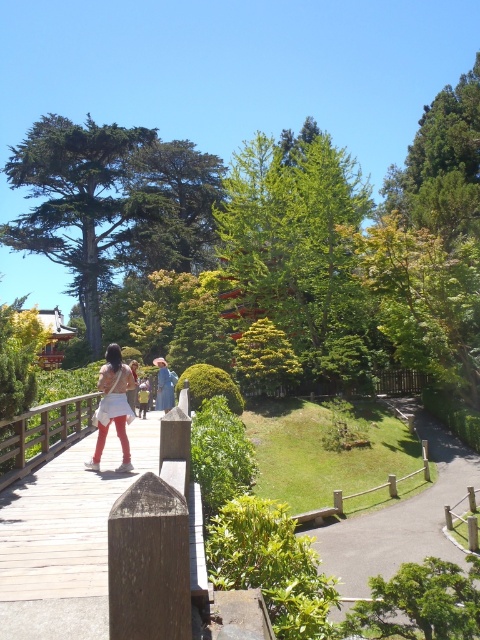
Question: Which object is the closest to the matte blue dress at center?

Choices:
 (A) matte white skirt at center
 (B) wooden bridge at center

Answer: (A)

Question: Which point appears closest to the camera in this image?

Choices:
 (A) pyautogui.click(x=156, y=376)
 (B) pyautogui.click(x=120, y=355)
 (C) pyautogui.click(x=178, y=440)

Answer: (C)

Question: Can you confirm if matte white skirt at center is positioned above matte blue dress at center?

Choices:
 (A) no
 (B) yes

Answer: (B)

Question: Is smooth asphalt path at center closer to camera compared to matte blue dress at center?

Choices:
 (A) no
 (B) yes

Answer: (B)

Question: Does wooden bridge at center appear over smooth asphalt path at center?

Choices:
 (A) yes
 (B) no

Answer: (A)

Question: Which of these objects is positioned farthest from the wooden bridge at center?

Choices:
 (A) smooth asphalt path at center
 (B) matte white skirt at center
 (C) matte blue dress at center

Answer: (A)